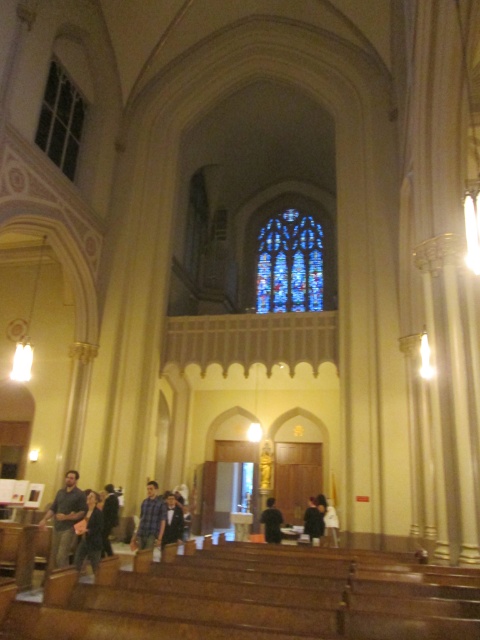
You are standing at the entrance of the church and want to place a small bouquet of flowers exactly at the center of the black fabric at center. According to the coordinates provided, where should you place the bouquet?

The black fabric at center is located at coordinates point (272, 522), so you should place the bouquet at that exact point to center it.

You are a photographer planning to take a portrait of two people wearing the dark blue shirt at center and dark brown leather jacket at lower center. Which clothing item will appear narrower in the photo?

The dark blue shirt at center will appear narrower in the photo because it has a lesser width compared to the dark brown leather jacket at lower center.

You are standing at the entrance of the church and see two shirts in the scene. Which shirt is positioned lower in the image, the blue plaid shirt at center or the dark blue shirt at lower center?

The dark blue shirt at lower center is positioned lower in the image.